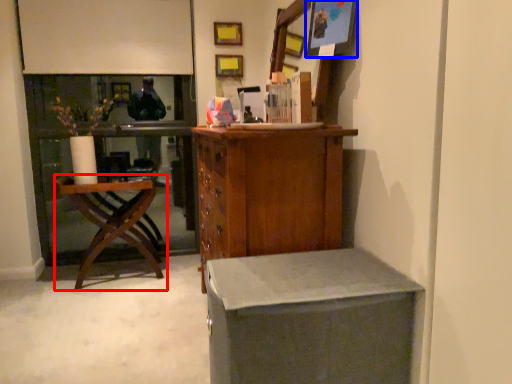
Question: Which object is further to the camera taking this photo, chair (highlighted by a red box) or picture frame (highlighted by a blue box)?

Choices:
 (A) chair
 (B) picture frame

Answer: (A)